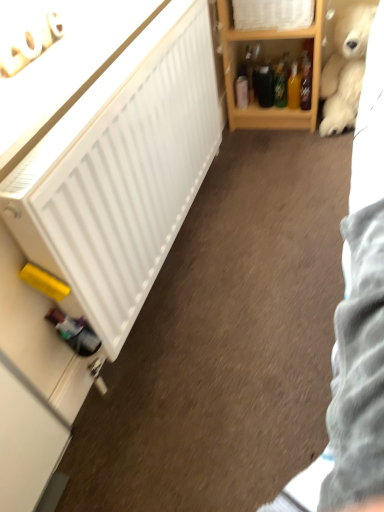
Question: In terms of width, does fluffy white teddy bear at upper right look wider or thinner when compared to wooden shelf at upper right?

Choices:
 (A) wide
 (B) thin

Answer: (A)

Question: Would you say fluffy white teddy bear at upper right is to the left or to the right of wooden shelf at upper right in the picture?

Choices:
 (A) left
 (B) right

Answer: (B)

Question: Which of these objects is positioned farthest from the translucent plastic bottle at upper right?

Choices:
 (A) fluffy white teddy bear at upper right
 (B) white wood cabinet at upper center
 (C) wooden shelf at upper right

Answer: (B)

Question: Estimate the real-world distances between objects in this image. Which object is farther from the fluffy white teddy bear at upper right?

Choices:
 (A) white wood cabinet at upper center
 (B) wooden shelf at upper right
 (C) translucent plastic bottle at upper right

Answer: (A)